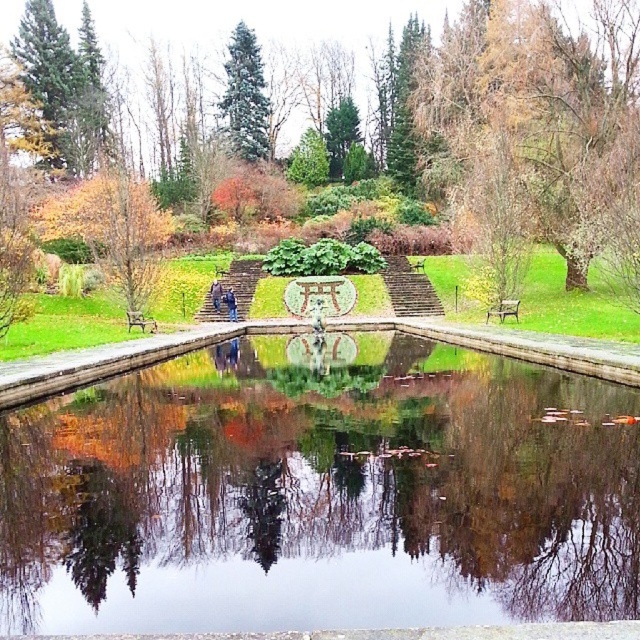
Does brown textured tree at right appear under green matte tree at upper center?

Yes, brown textured tree at right is below green matte tree at upper center.

Which of these two, brown textured tree at right or green matte tree at upper center, stands shorter?

With less height is green matte tree at upper center.

The width and height of the screenshot is (640, 640). In order to click on brown textured tree at right in this screenshot , I will do `click(544, 124)`.

Which is behind, point (256, 90) or point (500, 314)?

Point (256, 90)

Between green matte tree at upper center and green wooden bench at center, which one is positioned lower?

Positioned lower is green wooden bench at center.

Find the location of a particular element. green matte tree at upper center is located at coordinates (244, 96).

Can you confirm if green matte tree at upper center is bigger than wooden park bench at center?

Correct, green matte tree at upper center is larger in size than wooden park bench at center.

Does green matte tree at upper center come behind wooden park bench at center?

That is True.

The width and height of the screenshot is (640, 640). What do you see at coordinates (244, 96) in the screenshot? I see `green matte tree at upper center` at bounding box center [244, 96].

Find the location of a particular element. The height and width of the screenshot is (640, 640). green matte tree at upper center is located at coordinates (244, 96).